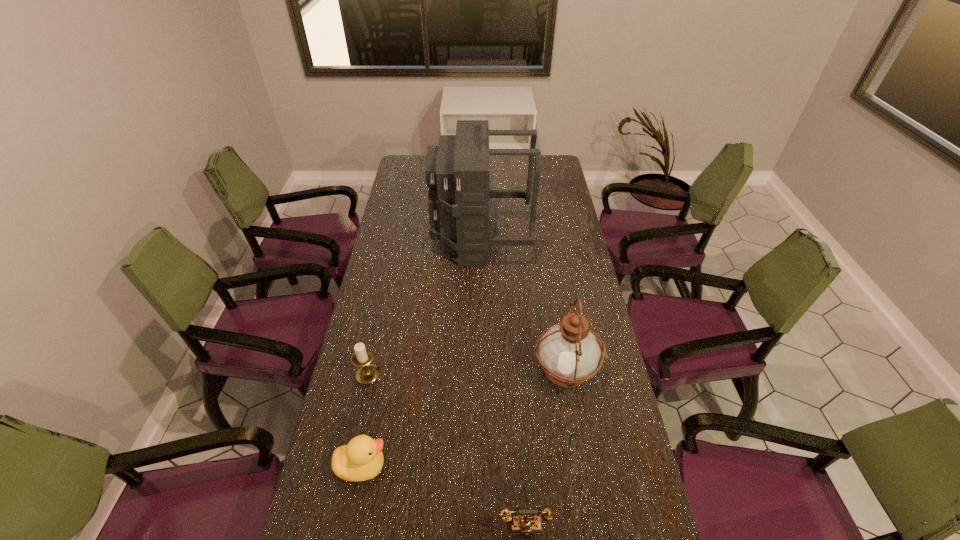
You are a GUI agent. You are given a task and a screenshot of the screen. Output one action in this format:
    pyautogui.click(x=<x>, y=<y>)
    Task: Click on the farthest object
    Image resolution: width=960 pixels, height=540 pixels.
    Given the screenshot: What is the action you would take?
    pyautogui.click(x=457, y=171)

This screenshot has height=540, width=960. Find the location of `backpack`. backpack is located at coordinates 457,171.

Where is `the fourth shortest object`? The width and height of the screenshot is (960, 540). the fourth shortest object is located at coordinates (569, 353).

Identify the location of candle holder. (367, 373).

The image size is (960, 540). In order to click on duck in this screenshot , I will do [362, 459].

The height and width of the screenshot is (540, 960). In order to click on vacant area located 0.120m on the front compartment of the farthest object in this screenshot , I will do `click(403, 239)`.

Where is `vacant space located on the front compartment of the farthest object`? vacant space located on the front compartment of the farthest object is located at coordinates (413, 239).

Locate an element on the screen. This screenshot has width=960, height=540. free region located 0.140m on the front compartment of the farthest object is located at coordinates 398,239.

The width and height of the screenshot is (960, 540). I want to click on free space located 0.180m on the left of the second tallest object, so click(473, 372).

This screenshot has width=960, height=540. I want to click on vacant space located on the right of the candle holder, so click(x=435, y=374).